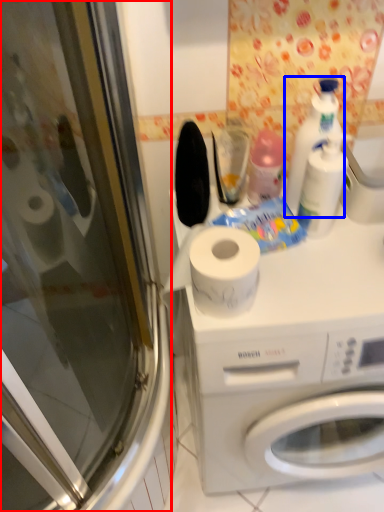
Question: Among these objects, which one is farthest to the camera, screen door (highlighted by a red box) or cleaning product (highlighted by a blue box)?

Choices:
 (A) screen door
 (B) cleaning product

Answer: (B)